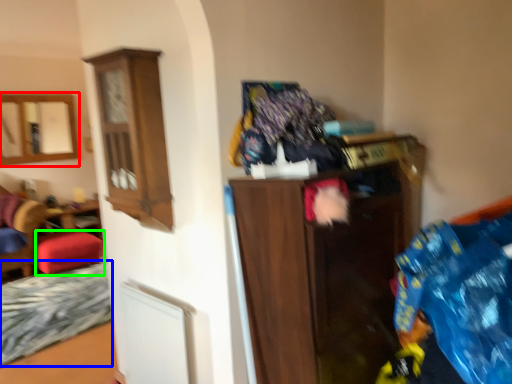
Question: Considering the real-world distances, which object is closest to mirror (highlighted by a red box)? bed frame (highlighted by a blue box) or stool (highlighted by a green box).

Choices:
 (A) bed frame
 (B) stool

Answer: (B)